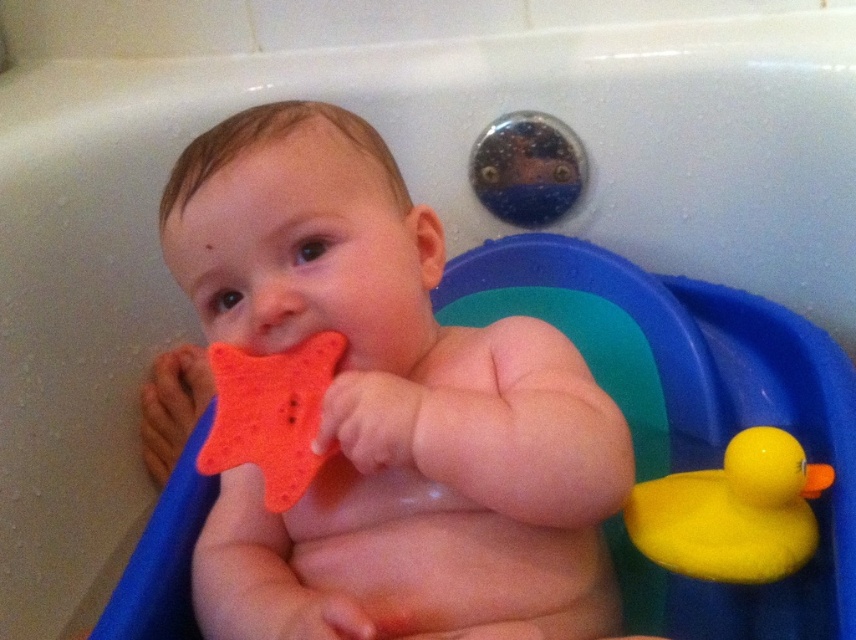
You are a parent trying to locate the rubber duck toy in the bathtub. The baby is sitting at the origin point of the coordinate system. The bathtub is represented as a coordinate plane where the bottom left corner is the origin. The coordinates of the rubber duck are given as point (733, 512). In which direction should you look to find the rubber duck relative to the baby?

The coordinates of the rubber duck at right are 0.800 in the x direction and 0.857 in the y direction. Since the baby is at the origin, you should look to the upper right direction to find the rubber duck at right.

You are a parent trying to hand your baby the rubber duck at right. The baby is currently holding the orange sponge at center. Can you safely place the duck within reach without the baby dropping the sponge?

The orange sponge at center and rubber duck at right are 19.97 centimeters apart. Since the distance is relatively large, placing the duck near the sponge might require careful positioning to avoid the baby dropping the sponge. However, the exact reach of the baby isn

You are a parent trying to clean your baby during bath time. You see the orange sponge at center and the orange sponge star at center in the water. Which object should you choose if you want to use the bigger one to wash the baby?

The orange sponge at center is larger in size than the orange sponge star at center, so you should choose the orange sponge at center to wash the baby.